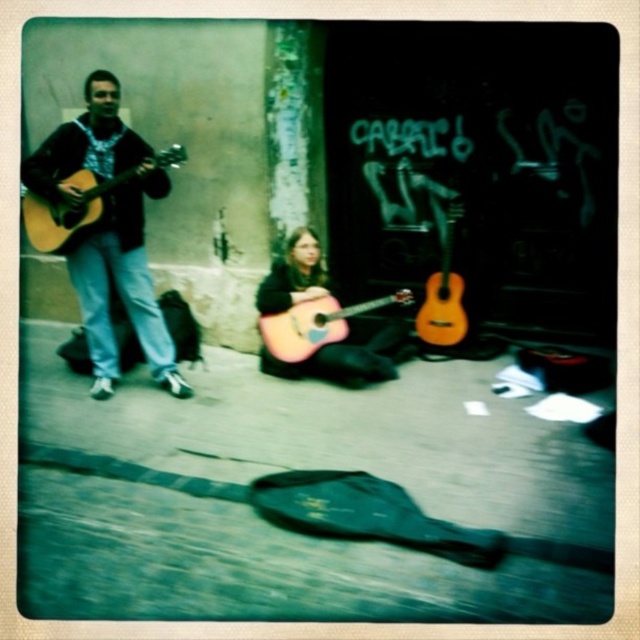
You are a street performer who wants to move your matte acoustic guitar at left closer to the acoustic wood guitar at center. Which direction should you move it to align them properly?

The matte acoustic guitar at left is already positioned on the left side of the acoustic wood guitar at center, so moving it to the right would align them properly.

You are standing in the street scene and want to hand the wooden acoustic guitar at center to a friend who is 1.8 meters away from you. Can you reach the guitar without moving closer?

The wooden acoustic guitar at center is 3.43 meters away from the viewer. Since your friend is only 1.8 meters away from you, you are closer to the guitar than your friend. However, the distance between you and the guitar is still 3.43 meters, which is too far to reach without moving closer. Therefore, you cannot reach the guitar without moving closer.

You are a street performer who wants to choose a guitar that is wider to play. You see the wooden acoustic guitar at center and the acoustic wood guitar at center. Which one should you choose?

The wooden acoustic guitar at center has a larger width than the acoustic wood guitar at center, so you should choose the wooden acoustic guitar at center.